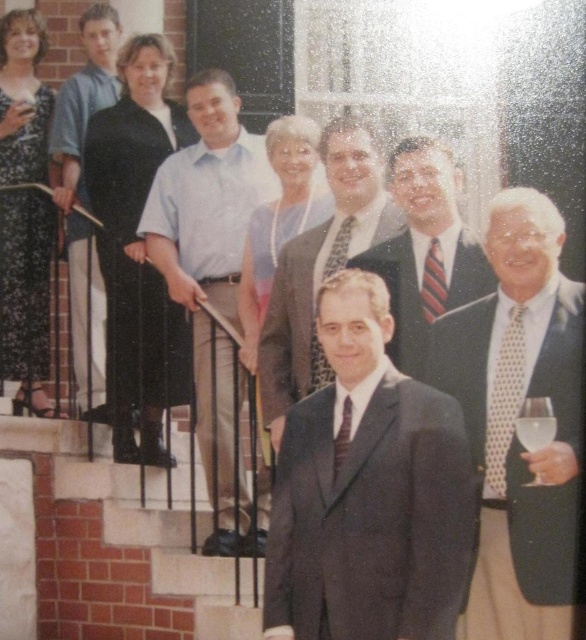
Question: Is white dotted tie at right wider than clear glass at lower right?

Choices:
 (A) yes
 (B) no

Answer: (A)

Question: Which point is farther from the camera taking this photo?

Choices:
 (A) (80, 92)
 (B) (352, 170)
 (C) (455, 305)
 (D) (255, 259)

Answer: (A)

Question: Can you confirm if dark brown suit at center is positioned to the right of shiny dark suit at center?

Choices:
 (A) yes
 (B) no

Answer: (B)

Question: Based on their relative distances, which object is farther from the shiny dark suit at center?

Choices:
 (A) white dotted tie at right
 (B) matte blue dress at center
 (C) dark brown suit at center

Answer: (B)

Question: Is dark gray suit at center bigger than clear glass wine glass at lower right?

Choices:
 (A) yes
 (B) no

Answer: (A)

Question: Which object is closer to the camera taking this photo?

Choices:
 (A) light blue shirt at center
 (B) clear glass at lower right
 (C) black silk dress at upper left
 (D) light blue shirt at upper left

Answer: (B)